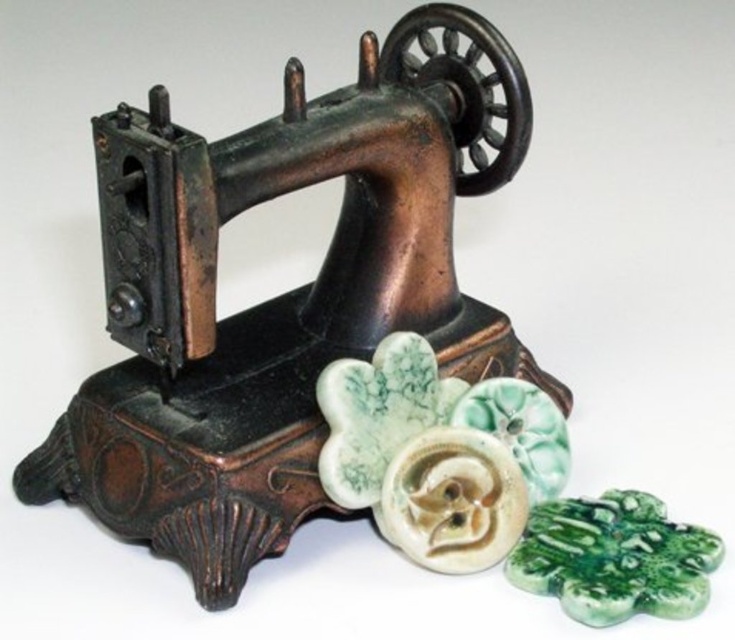
Question: Which point is farther to the camera?

Choices:
 (A) green glazed clover at center
 (B) green glazed ceramic flower at center

Answer: (B)

Question: Can you confirm if copper-bronze sewing machine at center is positioned to the right of green marble flower at center?

Choices:
 (A) yes
 (B) no

Answer: (B)

Question: From the image, what is the correct spatial relationship of copper-bronze sewing machine at center in relation to green marble flower at center?

Choices:
 (A) above
 (B) below

Answer: (A)

Question: Which point appears closest to the camera in this image?

Choices:
 (A) [548, 397]
 (B) [444, 316]
 (C) [602, 529]
 (D) [398, 403]

Answer: (C)

Question: Which point is closer to the camera?

Choices:
 (A) 628,524
 (B) 420,394
 (C) 150,419

Answer: (C)

Question: Where is green glazed clover at center located in relation to green glazed ceramic flower at center in the image?

Choices:
 (A) right
 (B) left

Answer: (A)